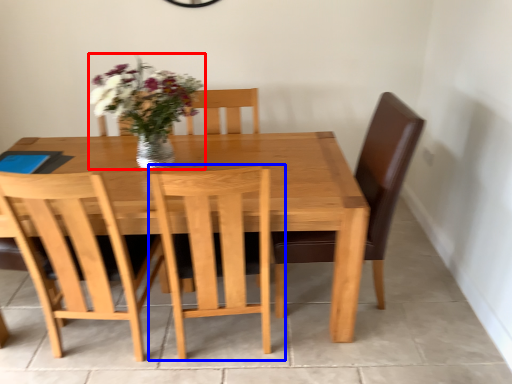
Question: Which object appears closest to the camera in this image, floral arrangement (highlighted by a red box) or chair (highlighted by a blue box)?

Choices:
 (A) floral arrangement
 (B) chair

Answer: (B)